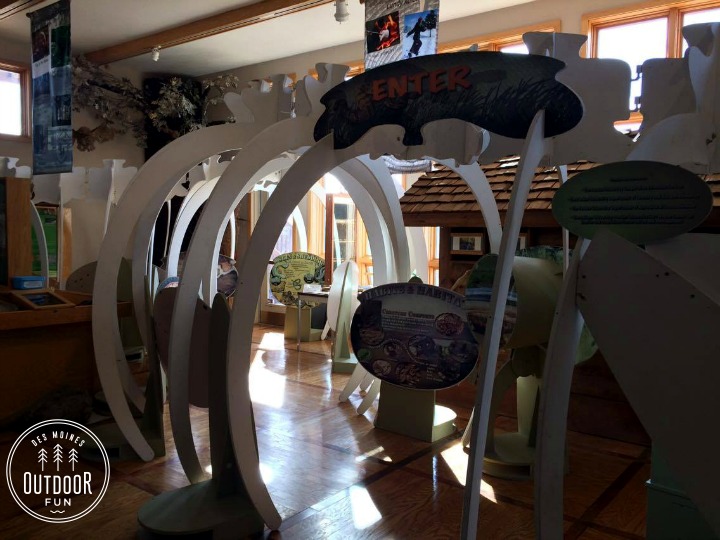
Find the location of a particular element. window is located at coordinates (467, 240), (518, 243).